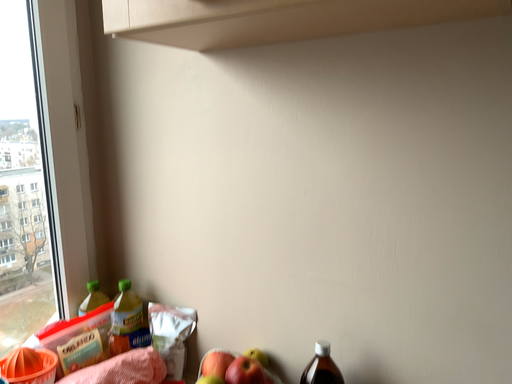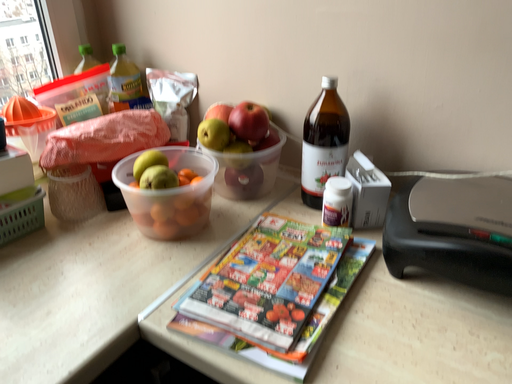
Question: How did the camera likely rotate when shooting the video?

Choices:
 (A) rotated downward
 (B) rotated upward

Answer: (A)